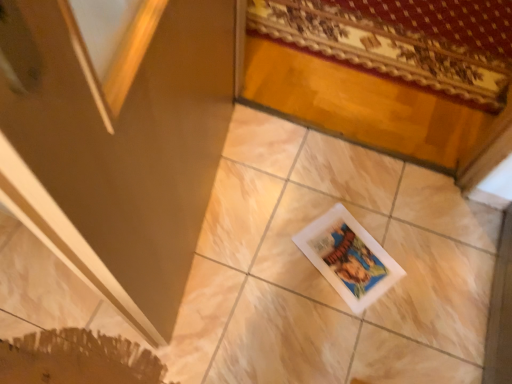
Identify the location of vacant region above white matte picture frame at center (from a real-world perspective). (348, 258).